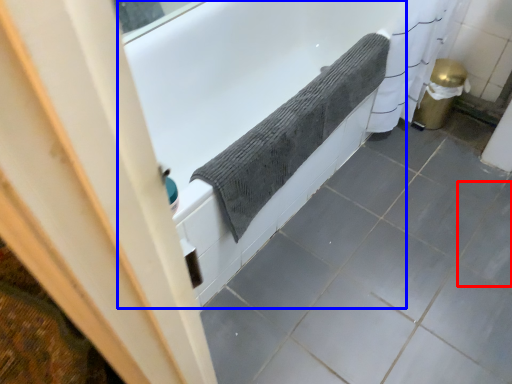
Question: Among these objects, which one is farthest to the camera, ceramic tile (highlighted by a red box) or bathtub (highlighted by a blue box)?

Choices:
 (A) ceramic tile
 (B) bathtub

Answer: (A)